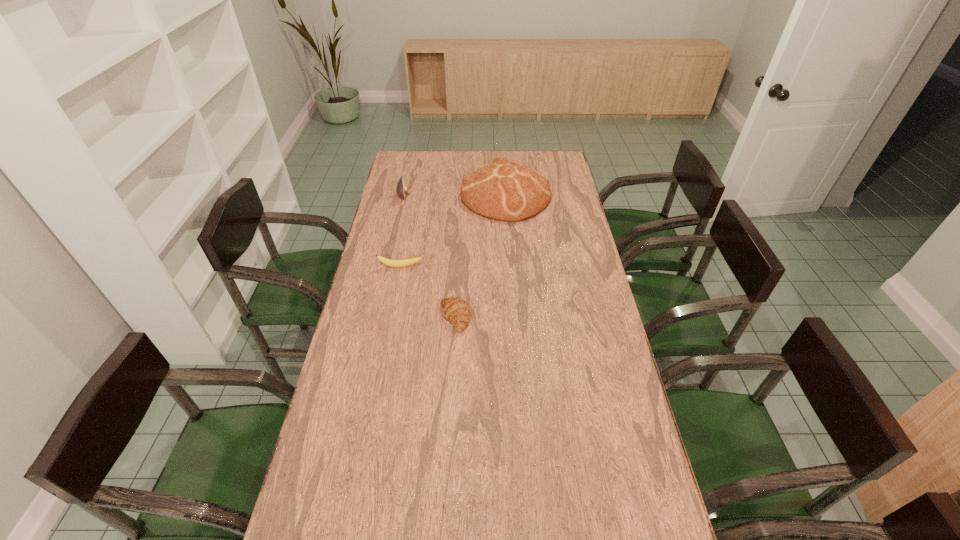
At what (x,y) coordinates should I click in order to perform the action: click on free region that satisfies the following two spatial constraints: 1. on the seed side of the avocado; 2. on the left side of the nearest object. Please return your answer as a coordinate pair (x, y). Image resolution: width=960 pixels, height=540 pixels. Looking at the image, I should click on (377, 318).

Where is `vacant space that satisfies the following two spatial constraints: 1. on the upward curve of the nearest object; 2. on the right side of the third farthest object`? vacant space that satisfies the following two spatial constraints: 1. on the upward curve of the nearest object; 2. on the right side of the third farthest object is located at coordinates (391, 318).

The image size is (960, 540). What are the coordinates of `free spot that satisfies the following two spatial constraints: 1. on the front side of the bread; 2. on the seed side of the third shortest object` in the screenshot? It's located at (506, 195).

I want to click on free space that satisfies the following two spatial constraints: 1. on the upward curve of the nearest object; 2. on the left side of the banana, so click(391, 318).